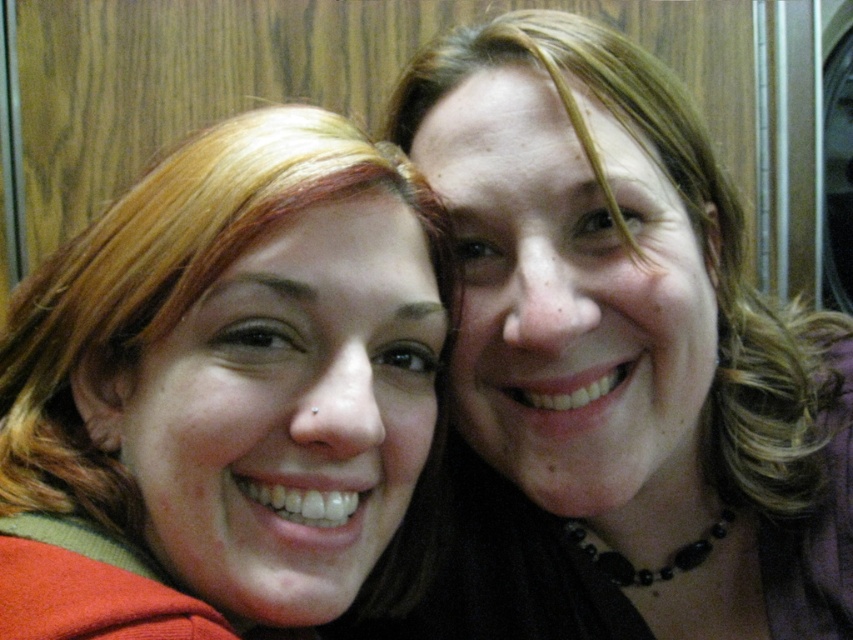
Does point (517, 205) lie in front of point (102, 467)?

Yes.

Find the location of a particular element. The height and width of the screenshot is (640, 853). smooth black necklace at upper right is located at coordinates (625, 353).